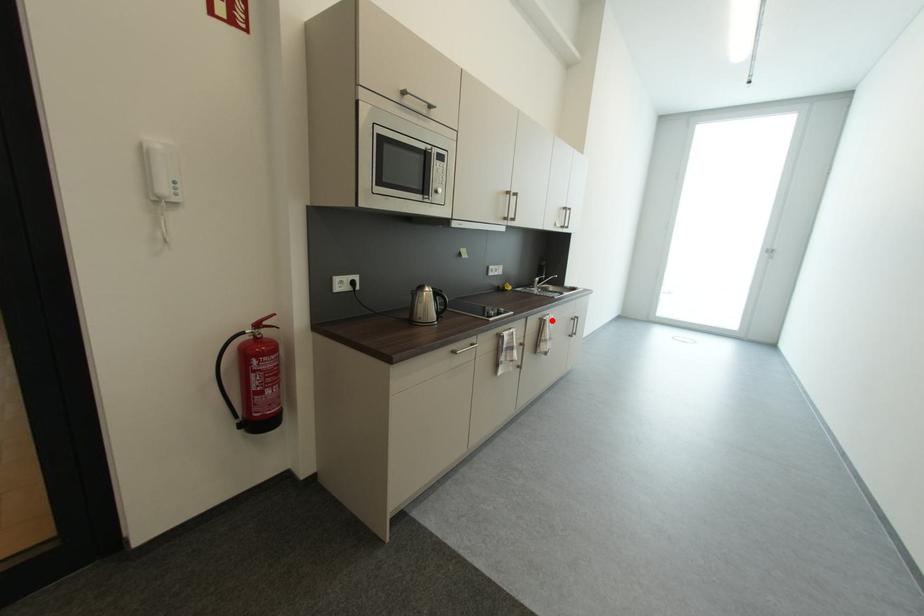
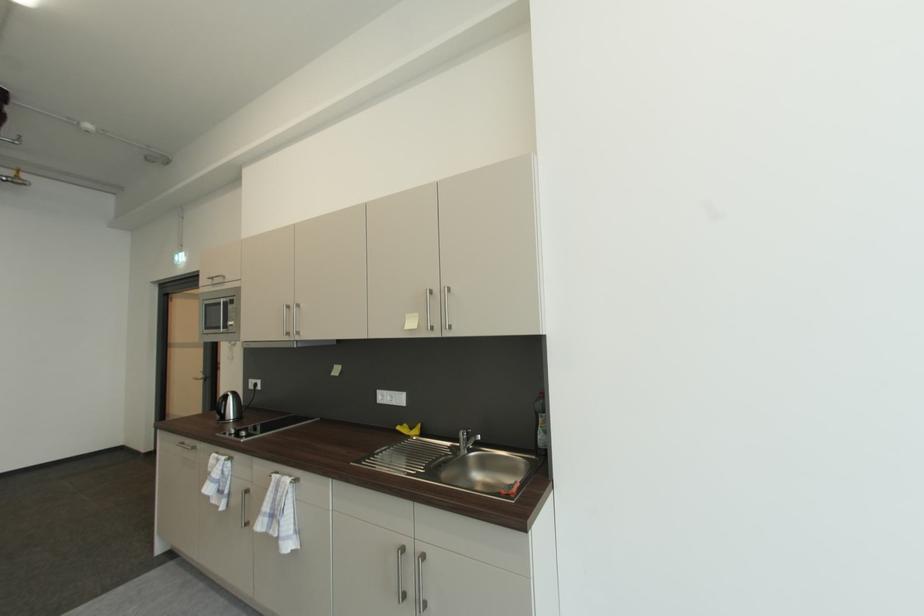
The point at the highlighted location is marked in the first image. Where is the corresponding point in the second image?

(277, 477)